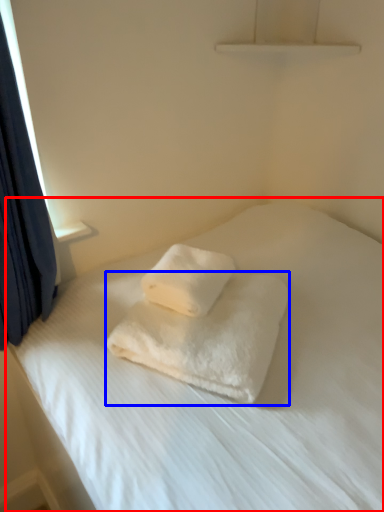
Question: Among these objects, which one is farthest to the camera, bed (highlighted by a red box) or towel (highlighted by a blue box)?

Choices:
 (A) bed
 (B) towel

Answer: (B)